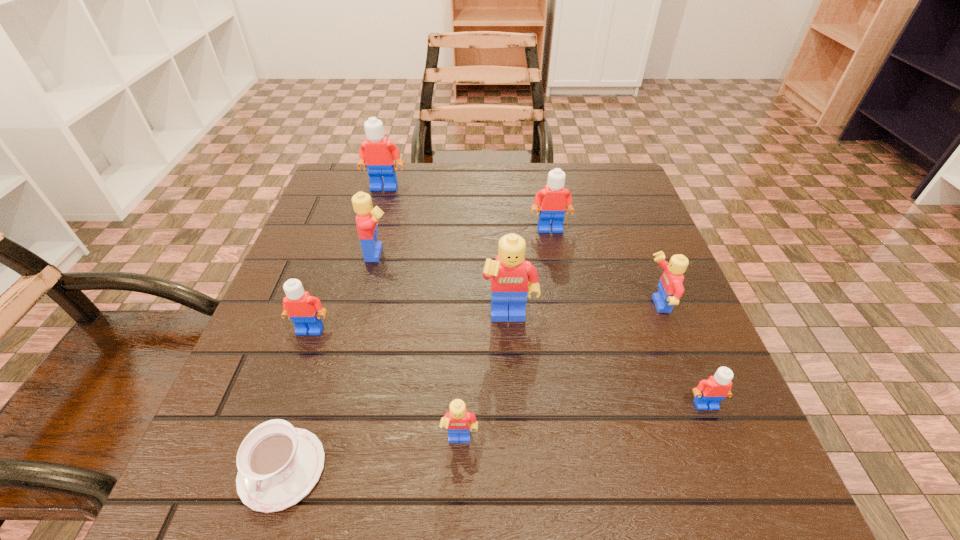
Identify the location of object present at the near left corner. (278, 465).

The width and height of the screenshot is (960, 540). In the image, there is a desktop. Find the location of `vacant region at the far edge`. vacant region at the far edge is located at coordinates (449, 207).

Locate an element on the screen. vacant area at the near edge is located at coordinates (389, 511).

You are a GUI agent. You are given a task and a screenshot of the screen. Output one action in this format:
    pyautogui.click(x=<x>, y=<y>)
    Task: Click on the free region at the left edge of the desktop
    This screenshot has height=540, width=960.
    Given the screenshot: What is the action you would take?
    pyautogui.click(x=284, y=363)

The width and height of the screenshot is (960, 540). Identify the location of vacant space at the right edge of the desktop. (638, 376).

The height and width of the screenshot is (540, 960). In order to click on vacant space at the far left corner in this screenshot , I will do `click(369, 188)`.

Locate an element on the screen. free space between the farthest object and the nearest Lego is located at coordinates (422, 314).

Where is `vacant area that lies between the third yellow Lego from left to right and the third yellow Lego from right to left`? vacant area that lies between the third yellow Lego from left to right and the third yellow Lego from right to left is located at coordinates (485, 381).

Identify the location of vacant space that is in between the shortest object and the farthest yellow Lego. (331, 361).

Where is `blank region between the shortest object and the third nearest object`? The height and width of the screenshot is (540, 960). blank region between the shortest object and the third nearest object is located at coordinates (493, 436).